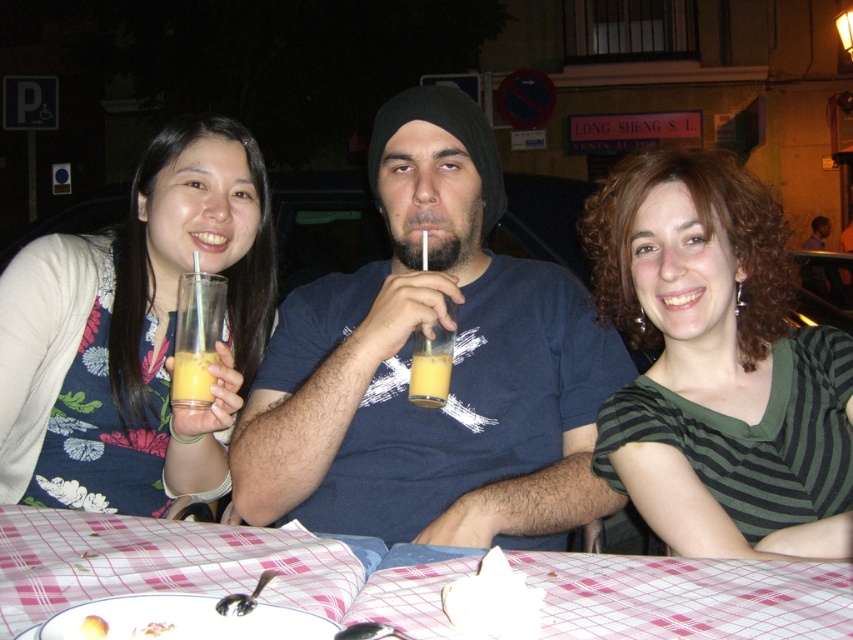
Is matte blue t-shirt at center bigger than green striped shirt at center?

Yes, matte blue t-shirt at center is bigger than green striped shirt at center.

Is matte blue t-shirt at center above green striped shirt at center?

Correct, matte blue t-shirt at center is located above green striped shirt at center.

This screenshot has width=853, height=640. Describe the element at coordinates (451, 368) in the screenshot. I see `matte blue t-shirt at center` at that location.

You are a GUI agent. You are given a task and a screenshot of the screen. Output one action in this format:
    pyautogui.click(x=<x>, y=<y>)
    Task: Click on the matte blue t-shirt at center
    This screenshot has height=640, width=853.
    Given the screenshot: What is the action you would take?
    pyautogui.click(x=451, y=368)

Consider the image. Can you confirm if green striped shirt at center is positioned to the right of translucent glass at left?

Correct, you'll find green striped shirt at center to the right of translucent glass at left.

Which is more to the left, green striped shirt at center or translucent glass at left?

translucent glass at left is more to the left.

At what (x,y) coordinates should I click in order to perform the action: click on green striped shirt at center. Please return your answer as a coordinate pair (x, y). The width and height of the screenshot is (853, 640). Looking at the image, I should click on tap(718, 365).

Can you confirm if white paper napkin at lower center is taller than yellow matte juice glass at center?

Yes.

Which is behind, point (494, 595) or point (136, 628)?

Positioned behind is point (494, 595).

Does point (474, 589) come behind point (148, 630)?

Yes.

The height and width of the screenshot is (640, 853). In order to click on white paper napkin at lower center in this screenshot , I will do `click(494, 600)`.